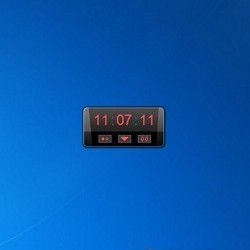
Where is `empty space left of clock`? The width and height of the screenshot is (250, 250). empty space left of clock is located at coordinates (39, 132).